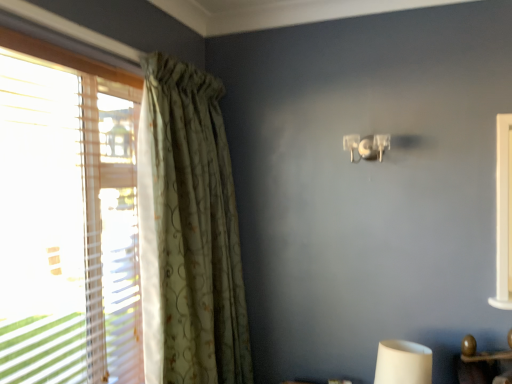
Locate an element on the screen. The width and height of the screenshot is (512, 384). green floral fabric curtain at left is located at coordinates (188, 232).

Measure the distance between point (172, 284) and camera.

The distance of point (172, 284) from camera is 1.88 meters.

This screenshot has width=512, height=384. What do you see at coordinates (188, 232) in the screenshot? I see `green floral fabric curtain at left` at bounding box center [188, 232].

Describe the element at coordinates (367, 146) in the screenshot. I see `clear plastic lamp at upper center` at that location.

You are a GUI agent. You are given a task and a screenshot of the screen. Output one action in this format:
    pyautogui.click(x=<x>, y=<y>)
    Task: Click on the clear plastic lamp at upper center
    
    Given the screenshot: What is the action you would take?
    pyautogui.click(x=367, y=146)

What is the approximate width of clear plastic lamp at upper center?

clear plastic lamp at upper center is 8.27 inches in width.

What is the approximate height of clear plastic lamp at upper center?

clear plastic lamp at upper center is 6.88 inches tall.

The height and width of the screenshot is (384, 512). Identify the location of green floral fabric curtain at left. (188, 232).

Is clear plastic lamp at upper center at the right side of green floral fabric curtain at left?

Correct, you'll find clear plastic lamp at upper center to the right of green floral fabric curtain at left.

Considering the positions of objects clear plastic lamp at upper center and green floral fabric curtain at left in the image provided, who is behind, clear plastic lamp at upper center or green floral fabric curtain at left?

clear plastic lamp at upper center is further away from the camera.

Does point (357, 139) appear closer or farther from the camera than point (231, 309)?

Point (357, 139) is positioned closer to the camera compared to point (231, 309).

From the image's perspective, which is above, clear plastic lamp at upper center or green floral fabric curtain at left?

clear plastic lamp at upper center.

Consider the image. From a real-world perspective, is clear plastic lamp at upper center below green floral fabric curtain at left?

No, from a real-world perspective, clear plastic lamp at upper center is not beneath green floral fabric curtain at left.

Is clear plastic lamp at upper center wider or thinner than green floral fabric curtain at left?

Considering their sizes, clear plastic lamp at upper center looks slimmer than green floral fabric curtain at left.

From the picture: Considering the sizes of objects clear plastic lamp at upper center and green floral fabric curtain at left in the image provided, who is taller, clear plastic lamp at upper center or green floral fabric curtain at left?

With more height is green floral fabric curtain at left.

Who is smaller, clear plastic lamp at upper center or green floral fabric curtain at left?

With smaller size is clear plastic lamp at upper center.

Is green floral fabric curtain at left surrounded by clear plastic lamp at upper center?

Definitely not — green floral fabric curtain at left is not inside clear plastic lamp at upper center.

Is the surface of clear plastic lamp at upper center in direct contact with green floral fabric curtain at left?

There is a gap between clear plastic lamp at upper center and green floral fabric curtain at left.

Is clear plastic lamp at upper center positioned with its back to green floral fabric curtain at left?

No.

The height and width of the screenshot is (384, 512). In order to click on curtain located in front of the clear plastic lamp at upper center in this screenshot , I will do `click(188, 232)`.

Between green floral fabric curtain at left and clear plastic lamp at upper center, which one appears on the left side from the viewer's perspective?

green floral fabric curtain at left.

Is green floral fabric curtain at left closer to the viewer compared to clear plastic lamp at upper center?

Yes, it is.

Considering the positions of point (140, 208) and point (384, 138), is point (140, 208) closer or farther from the camera than point (384, 138)?

Point (140, 208) is closer to the camera than point (384, 138).

From the image's perspective, relative to clear plastic lamp at upper center, is green floral fabric curtain at left above or below?

green floral fabric curtain at left is below clear plastic lamp at upper center.

From a real-world perspective, which object rests below the other?

green floral fabric curtain at left, from a real-world perspective.

Can you confirm if green floral fabric curtain at left is thinner than clear plastic lamp at upper center?

Incorrect, the width of green floral fabric curtain at left is not less than that of clear plastic lamp at upper center.

Is green floral fabric curtain at left taller than clear plastic lamp at upper center?

Yes, green floral fabric curtain at left is taller than clear plastic lamp at upper center.

Considering the relative sizes of green floral fabric curtain at left and clear plastic lamp at upper center in the image provided, is green floral fabric curtain at left smaller than clear plastic lamp at upper center?

Incorrect, green floral fabric curtain at left is not smaller in size than clear plastic lamp at upper center.

Which is correct: green floral fabric curtain at left is inside clear plastic lamp at upper center, or outside of it?

green floral fabric curtain at left lies outside clear plastic lamp at upper center.

Is green floral fabric curtain at left far away from clear plastic lamp at upper center?

No.

Is green floral fabric curtain at left facing away from clear plastic lamp at upper center?

green floral fabric curtain at left does not have its back to clear plastic lamp at upper center.

Identify the location of lamp behind the green floral fabric curtain at left. (367, 146).

Find the location of a particular element. This screenshot has width=512, height=384. curtain in front of the clear plastic lamp at upper center is located at coordinates (188, 232).

The height and width of the screenshot is (384, 512). Find the location of `curtain below the clear plastic lamp at upper center (from the image's perspective)`. curtain below the clear plastic lamp at upper center (from the image's perspective) is located at coordinates (188, 232).